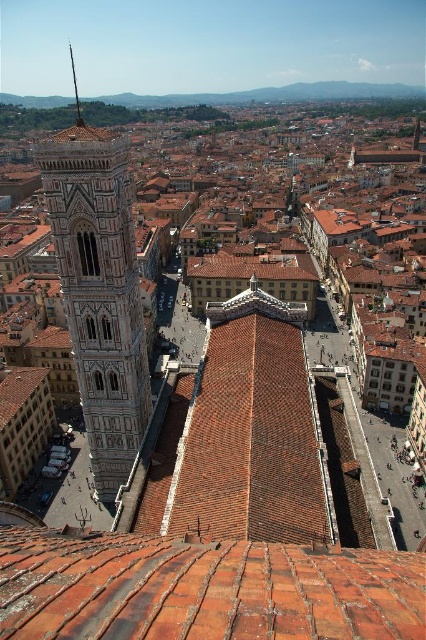
Between terracotta tiles at center and polished bronze spire at upper left, which one appears on the right side from the viewer's perspective?

terracotta tiles at center is more to the right.

Does point (252, 588) come farther from viewer compared to point (69, 49)?

No, (252, 588) is in front of (69, 49).

Measure the distance between terracotta tiles at center and camera.

terracotta tiles at center is 71.88 feet away from camera.

Identify the location of terracotta tiles at center. (203, 589).

Consider the image. Does terracotta tiles at center have a smaller size compared to white stone bell tower at left?

Yes, terracotta tiles at center is smaller than white stone bell tower at left.

Consider the image. Which is more to the left, terracotta tiles at center or white stone bell tower at left?

white stone bell tower at left

Is point (106, 634) farther from camera compared to point (92, 348)?

No, it is not.

Locate an element on the screen. Image resolution: width=426 pixels, height=640 pixels. terracotta tiles at center is located at coordinates point(203,589).

Can you confirm if white stone bell tower at left is positioned to the right of polished bronze spire at upper left?

Yes, white stone bell tower at left is to the right of polished bronze spire at upper left.

Does white stone bell tower at left have a smaller size compared to polished bronze spire at upper left?

Yes.

The image size is (426, 640). What do you see at coordinates (100, 292) in the screenshot?
I see `white stone bell tower at left` at bounding box center [100, 292].

The width and height of the screenshot is (426, 640). Find the location of `white stone bell tower at left`. white stone bell tower at left is located at coordinates (100, 292).